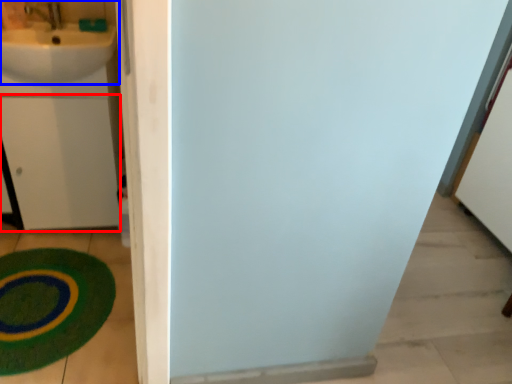
Question: Which of the following is the closest to the observer, drawer (highlighted by a red box) or sink (highlighted by a blue box)?

Choices:
 (A) drawer
 (B) sink

Answer: (B)